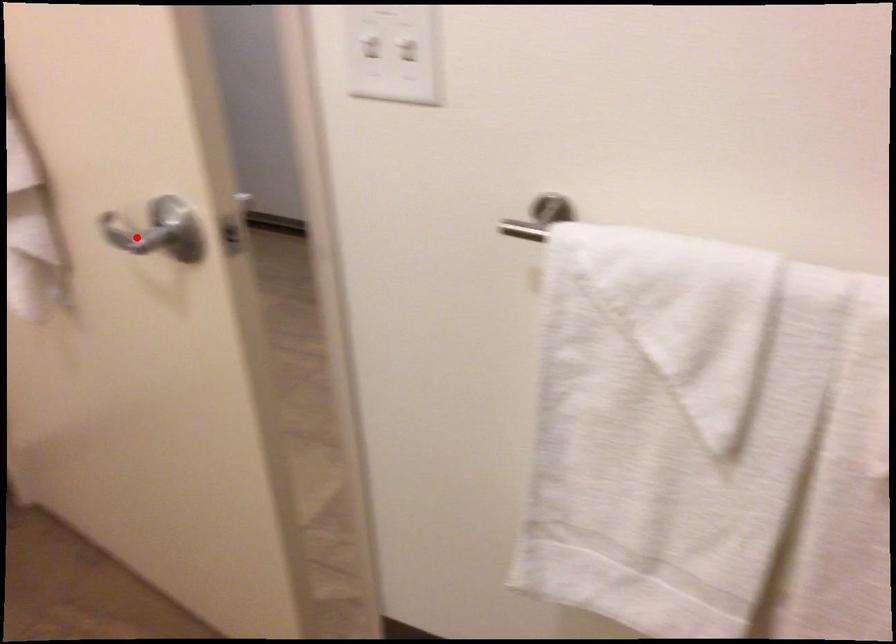
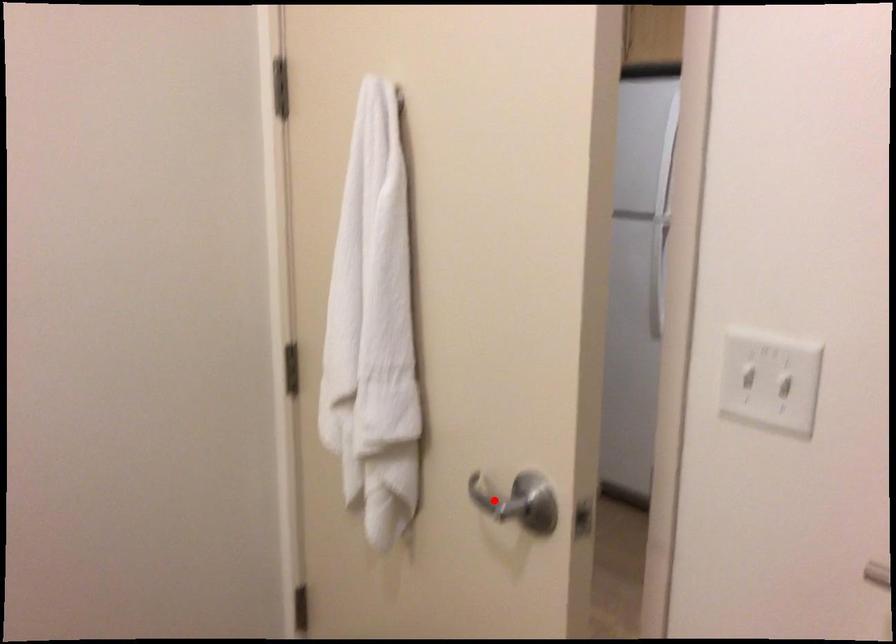
I am providing you with two images of the same scene from different viewpoints. A red point is marked on the first image and another point is marked on the second image. Is the red point in image1 aligned with the point shown in image2?

Yes